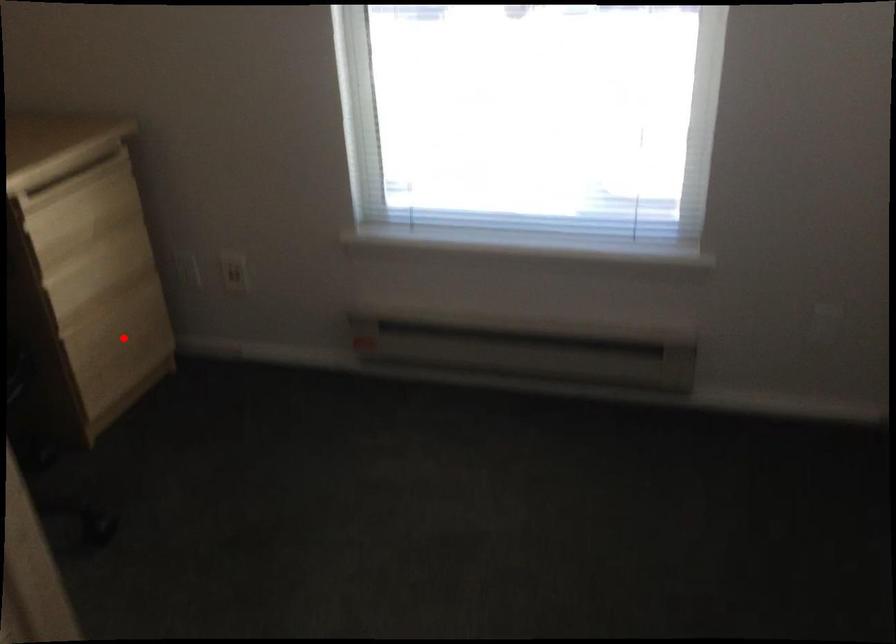
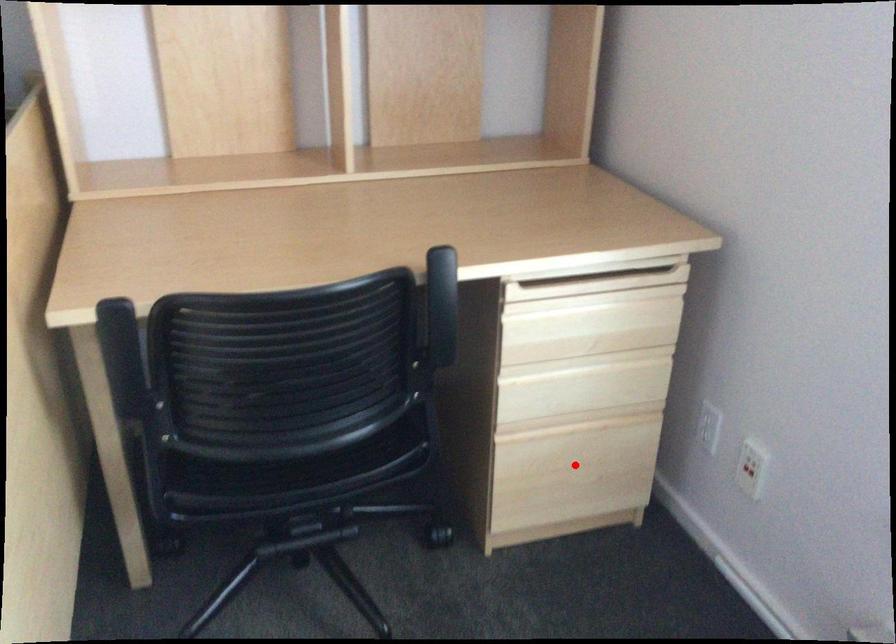
I am providing you with two images of the same scene from different viewpoints. A red point is marked on the first image and another point is marked on the second image. Do the highlighted points in image1 and image2 indicate the same real-world spot?

Yes